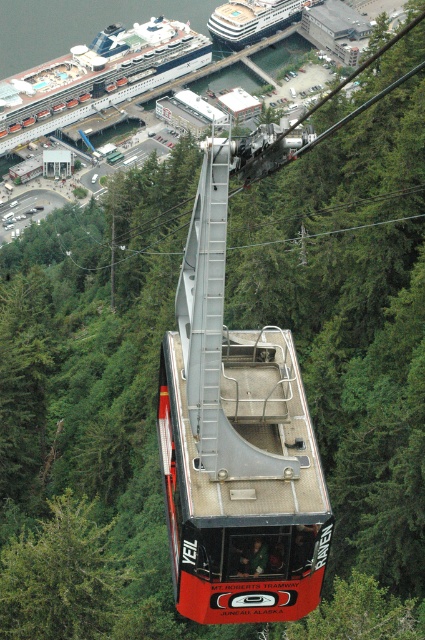
You are a passenger in the cable car and want to know which point is closer to you. The points are labeled as point 1 at coordinates (x=240, y=435) and point 2 at coordinates (x=59, y=561). Which point is closer to your position in the cable car?

Point 1 at coordinates (x=240, y=435) is closer to the viewer than point 2 at coordinates (x=59, y=561).

You are a passenger in the red matte cable car at center and want to take a photo of the green leafy tree at center. Since both are at the center, will the tree be fully visible in your photo if you point your camera straight ahead?

The red matte cable car at center is closer to the viewer than the green leafy tree at center, so the cable car will block the view of the tree when pointing the camera straight ahead. The tree will not be fully visible.

You are a passenger in the red matte cable car at center and want to take a photo of the white glossy cruise ship at upper left. Can you see it from your current position?

The red matte cable car at center is positioned under the white glossy cruise ship at upper left, so yes, you can see the white glossy cruise ship at upper left from your current position in the cable car.